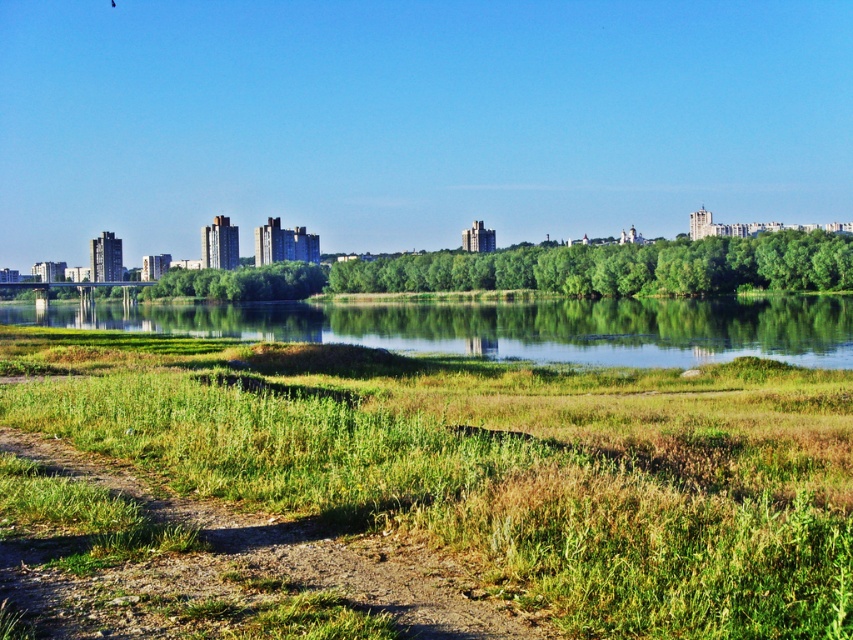
You are standing at the point marked as point (497,465) in the image. What do you see directly beneath your feet?

You see green grass at lower center directly beneath your feet at point (497,465).